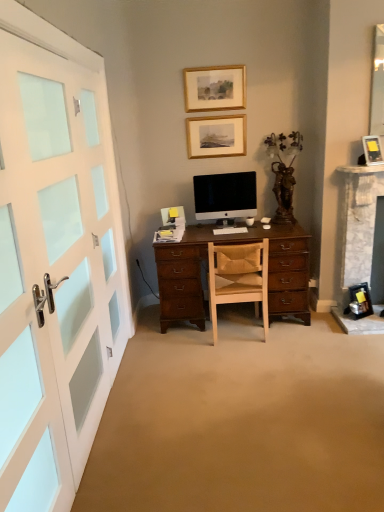
Locate an element on the screen. The image size is (384, 512). vacant space in gold/glossy picture frame at upper center, placed as the 1th picture frame when sorted from left to right (from a real-world perspective) is located at coordinates (223, 111).